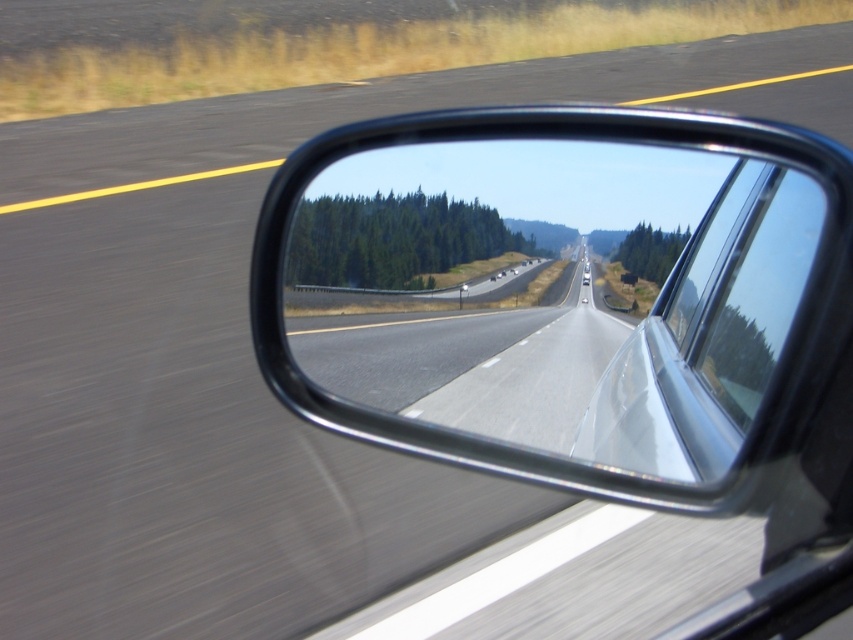
You are a driver checking the side mirror of your car. The mirror is located at the black glossy mirror at center. If the mirror were to move 0.1 units to the left, would it still show the road ahead? Please explain based on its current position at point 0.461, 0.661.

The black glossy mirror at center is currently positioned at point (563, 294). Moving it 0.1 units to the left would adjust its position to approximately (563, 230). Since the mirror is reflecting the road ahead as described in the scene, a slight lateral shift might still allow visibility of the road, but precise visibility depends on the mirror adjustment range and vehicle design. However, based on the provided information, the original position already captures the road ahead, so minor adjustments to

You are a passenger in the car and want to look at the road ahead through the black glossy mirror at center and the transparent glass car window at center. Which object allows you to see a taller portion of the road ahead?

The transparent glass car window at center allows you to see a taller portion of the road ahead because it has a greater height than the black glossy mirror at center.

You are a passenger in the car and you see the point at coordinate [563,294]. What object is located at that coordinate?

The point at coordinate [563,294] corresponds to the black glossy mirror at center.